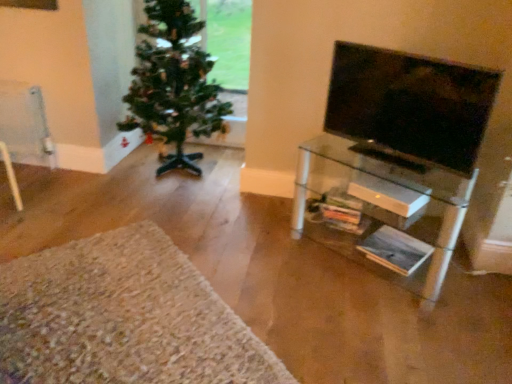
Where is `vacant area that is in front of clear glass shelf at right`? Image resolution: width=512 pixels, height=384 pixels. vacant area that is in front of clear glass shelf at right is located at coordinates (389, 321).